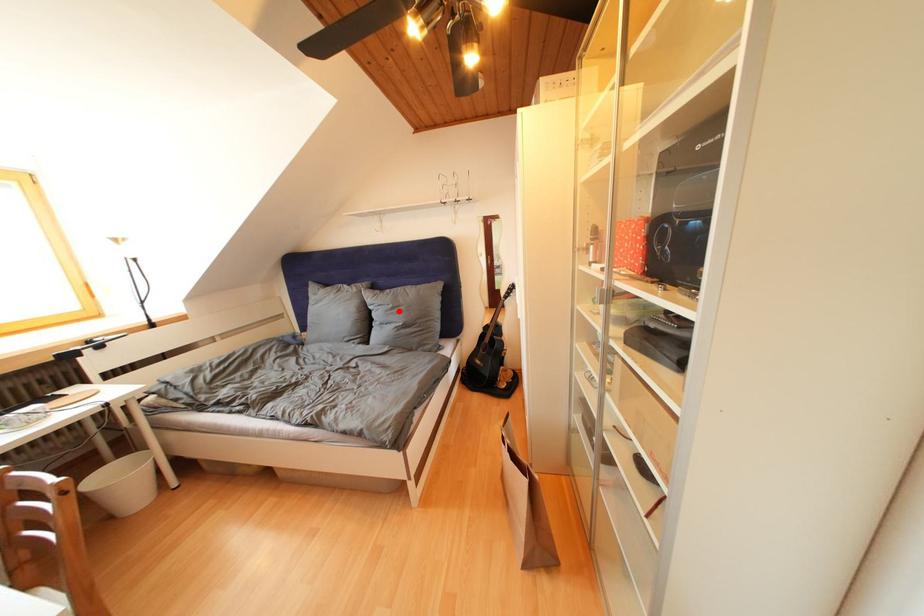
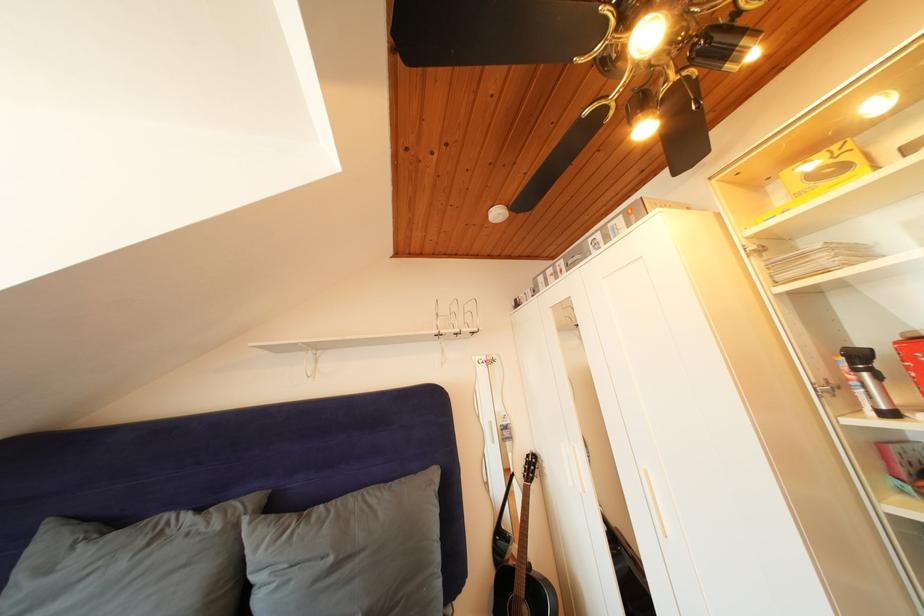
Where in the second image is the point corresponding to the highlighted location from the first image?

(338, 565)